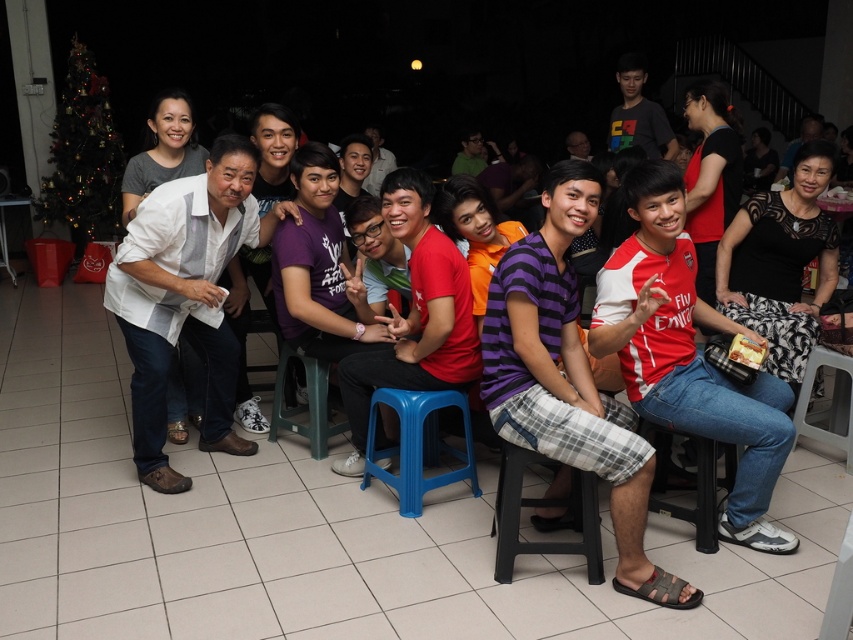
Question: Which of the following is the closest to the observer?

Choices:
 (A) black plastic stool at lower center
 (B) plastic stool at lower right

Answer: (A)

Question: Observing the image, what is the correct spatial positioning of black plastic stool at center in reference to plastic stool at lower right?

Choices:
 (A) below
 (B) above

Answer: (A)

Question: Can you confirm if black plastic stool at center is positioned to the left of plastic stool at lower right?

Choices:
 (A) no
 (B) yes

Answer: (B)

Question: Which of the following is the closest to the observer?

Choices:
 (A) plastic stool at lower right
 (B) black plastic stool at center
 (C) black plastic stool at lower center

Answer: (B)

Question: Does blue plastic stool at center come in front of black plastic stool at center?

Choices:
 (A) no
 (B) yes

Answer: (A)

Question: Estimate the real-world distances between objects in this image. Which object is farther from the black plastic stool at center?

Choices:
 (A) blue plastic stool at center
 (B) green plastic stool at center
 (C) plastic stool at lower right
 (D) black plastic stool at lower center

Answer: (C)